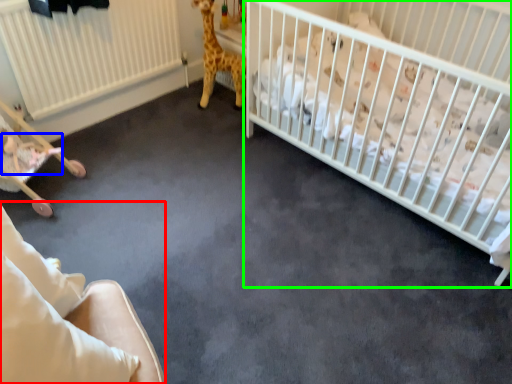
Question: Which is farther away from rocking chair (highlighted by a red box)? newborn (highlighted by a blue box) or infant bed (highlighted by a green box)?

Choices:
 (A) newborn
 (B) infant bed

Answer: (B)